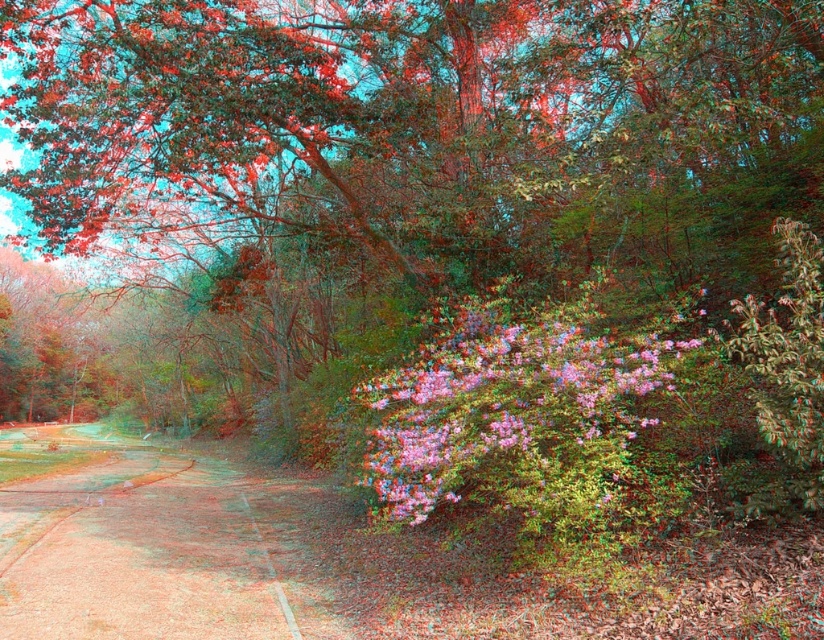
Question: Does brown dirt path at lower left appear under pink textured bush at center?

Choices:
 (A) yes
 (B) no

Answer: (A)

Question: Is brown dirt path at lower left further to the viewer compared to pink textured bush at center?

Choices:
 (A) no
 (B) yes

Answer: (B)

Question: Which point appears farthest from the camera in this image?

Choices:
 (A) (443, 368)
 (B) (109, 461)

Answer: (B)

Question: Is brown dirt path at lower left positioned before pink textured bush at center?

Choices:
 (A) no
 (B) yes

Answer: (A)

Question: Which point is farther to the camera?

Choices:
 (A) pink textured bush at center
 (B) brown dirt path at lower left

Answer: (B)